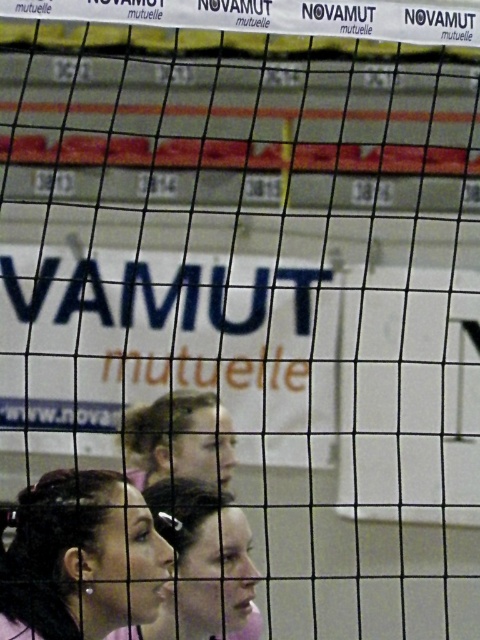
You are a photographer standing behind the volleyball net. You notice a matte pink shirt at lower left and a pink fabric at lower center. Which one is nearer to you?

The matte pink shirt at lower left is closer to the viewer than the pink fabric at lower center.

You are a photographer setting up for a volleyball game. You notice the pink fabric at lower center and the blonde hair at center in your frame. Which object will appear larger in your photo?

The pink fabric at lower center will appear larger in the photo because it has a greater height compared to the blonde hair at center.